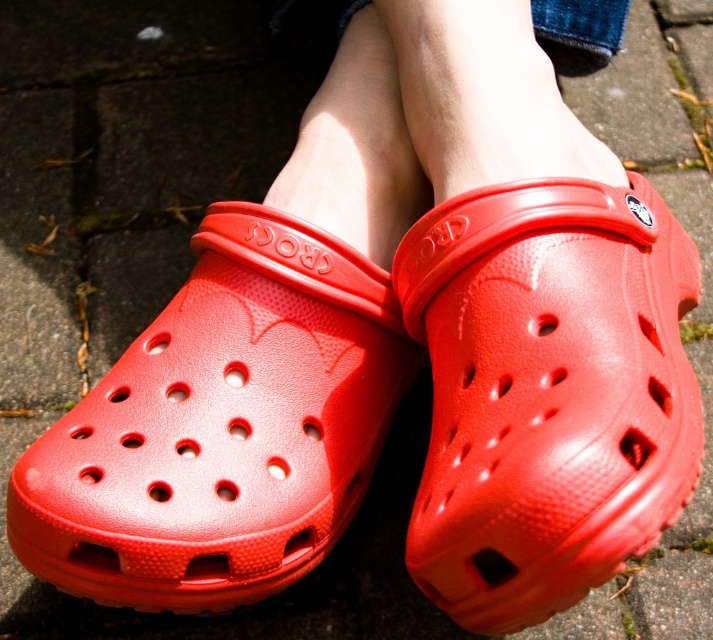
Can you confirm if satin red clog at center is smaller than matte plastic clog at center?

Incorrect, satin red clog at center is not smaller in size than matte plastic clog at center.

Which is above, satin red clog at center or matte plastic clog at center?

Positioned higher is satin red clog at center.

The width and height of the screenshot is (713, 640). What do you see at coordinates (548, 392) in the screenshot?
I see `satin red clog at center` at bounding box center [548, 392].

Find the location of `satin red clog at center`. satin red clog at center is located at coordinates (548, 392).